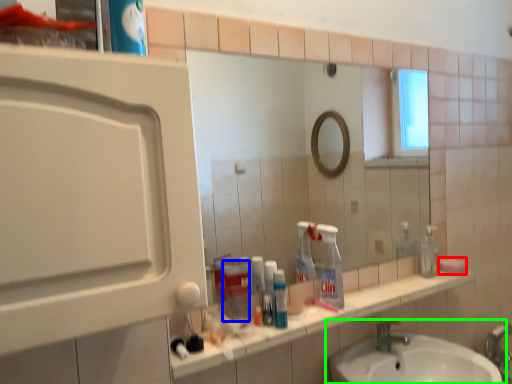
Question: Which object is the closest to the soap (highlighted by a red box)? Choose among these: bottle (highlighted by a blue box) or sink (highlighted by a green box).

Choices:
 (A) bottle
 (B) sink

Answer: (B)